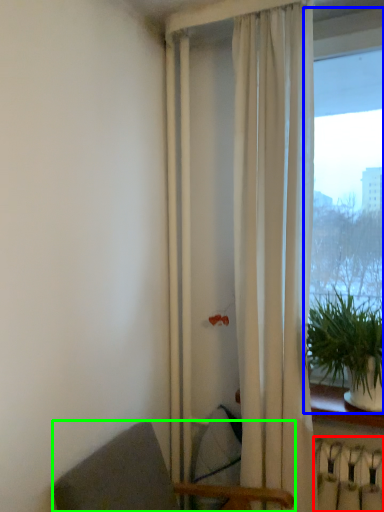
Question: Based on their relative distances, which object is nearer to radiator (highlighted by a red box)? Choose from window (highlighted by a blue box) and chair (highlighted by a green box).

Choices:
 (A) window
 (B) chair

Answer: (B)